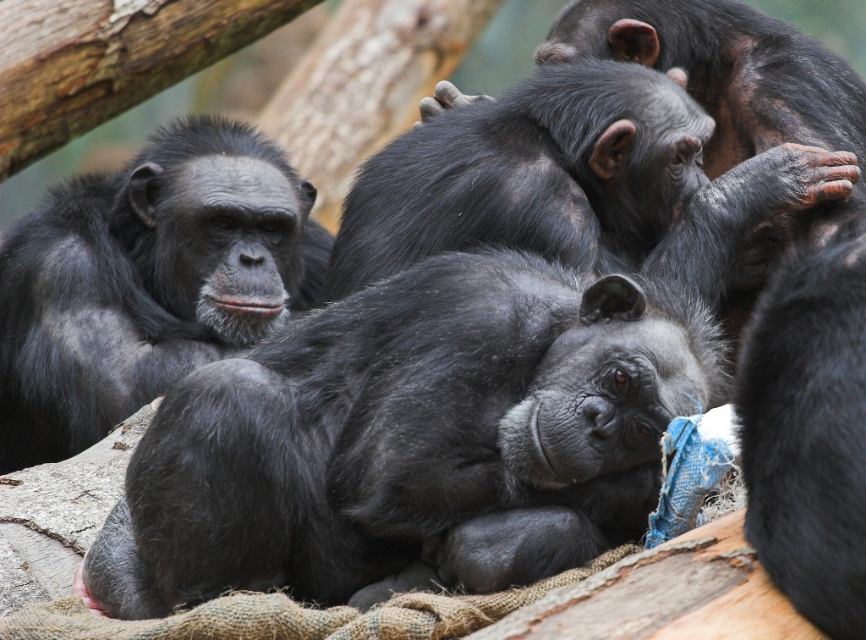
Question: Can you confirm if black fur monkey at center is wider than shiny black monkey at left?

Choices:
 (A) yes
 (B) no

Answer: (A)

Question: Does black fur monkey at center appear on the left side of shiny black monkey at left?

Choices:
 (A) no
 (B) yes

Answer: (A)

Question: Does black fur monkey at center have a larger size compared to shiny black monkey at left?

Choices:
 (A) no
 (B) yes

Answer: (A)

Question: Which point is farther to the camera?

Choices:
 (A) (126, 304)
 (B) (401, 280)

Answer: (A)